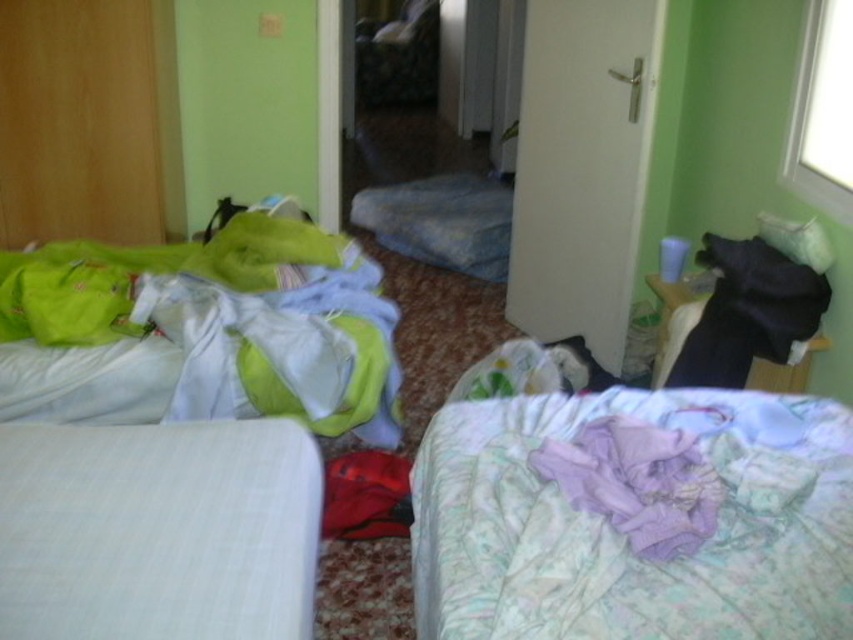
You are standing in the room and see the point marked at coordinates (x=634, y=518). What object does this point correspond to?

The point at coordinates (x=634, y=518) corresponds to the light purple floral blanket at lower right.